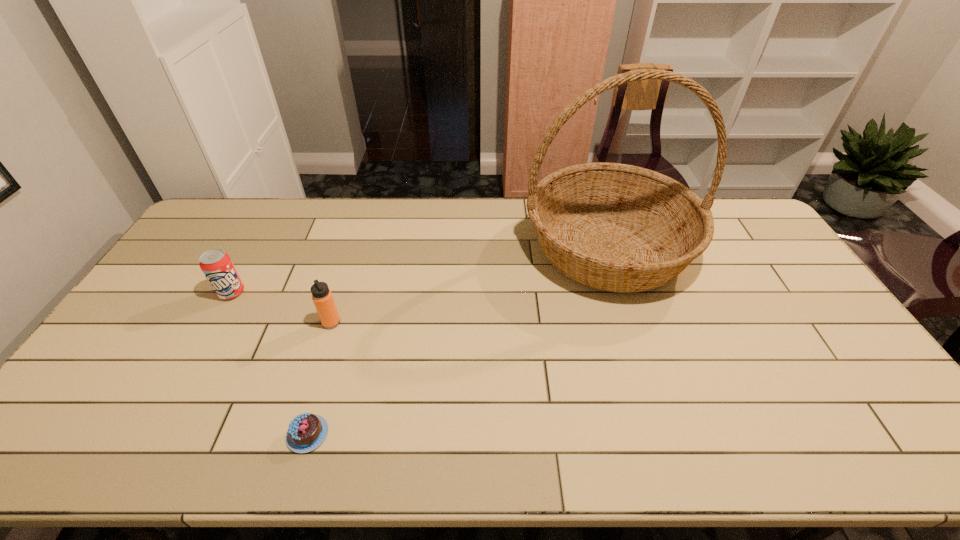
The height and width of the screenshot is (540, 960). In order to click on vacant space that satisfies the following two spatial constraints: 1. on the back side of the tallest object; 2. on the left side of the chocolate cake in this screenshot , I will do `click(363, 247)`.